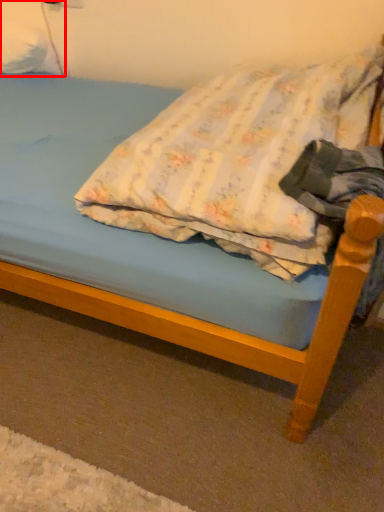
Question: Observing the image, what is the correct spatial positioning of pillow (annotated by the red box) in reference to pillow?

Choices:
 (A) right
 (B) left

Answer: (B)